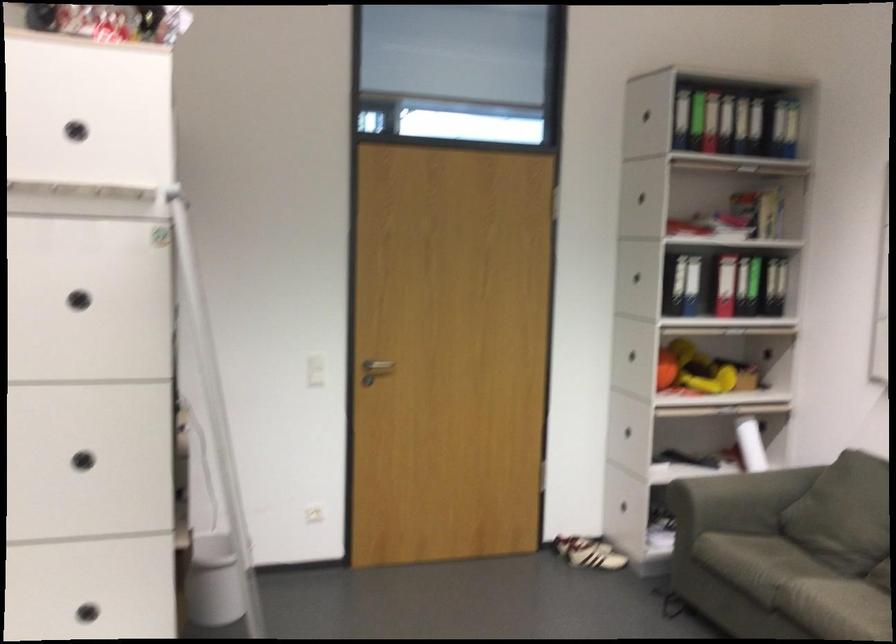
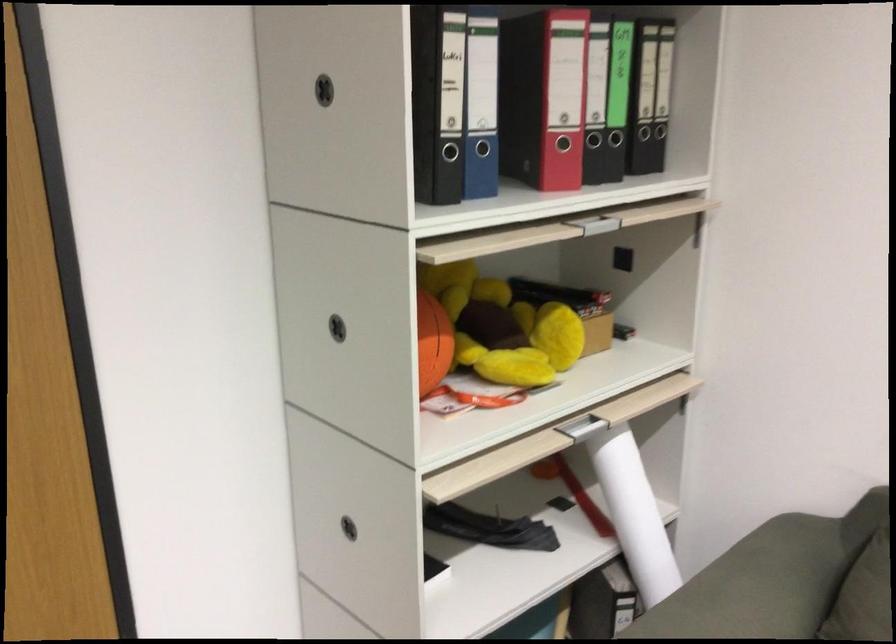
The point at (624, 346) is marked in the first image. Where is the corresponding point in the second image?

(337, 328)